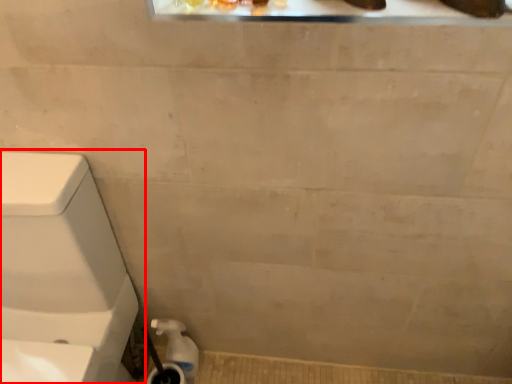
Question: From the image's perspective, what is the correct spatial relationship of toilet (annotated by the red box) in relation to water pipe?

Choices:
 (A) below
 (B) above

Answer: (B)